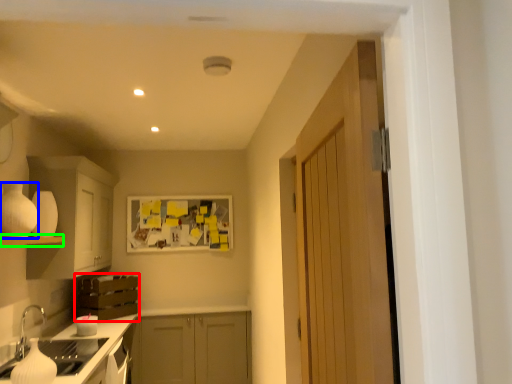
Question: Which object is positioned farthest from cabinetry (highlighted by a red box)? Select from appliance (highlighted by a blue box) and shelf (highlighted by a green box).

Choices:
 (A) appliance
 (B) shelf

Answer: (A)